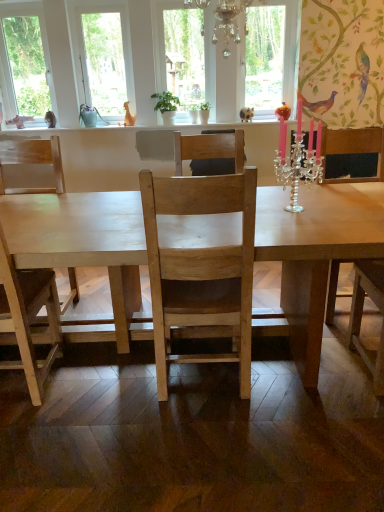
Where is `free space above clear glass window at upper left, the second window viewed from the right (from a real-world perspective)`? free space above clear glass window at upper left, the second window viewed from the right (from a real-world perspective) is located at coordinates [x=16, y=4].